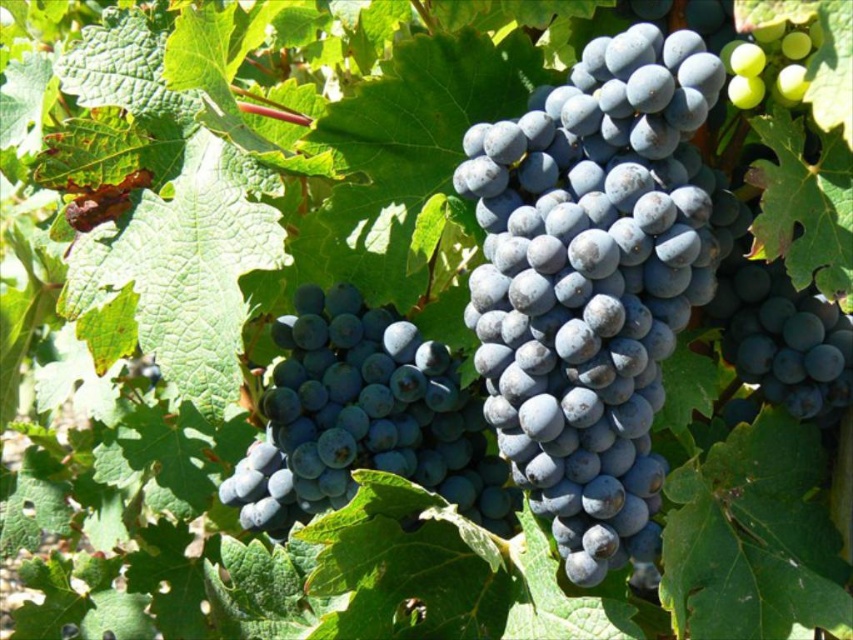
Does point (724, 342) come farther from viewer compared to point (755, 56)?

Yes, point (724, 342) is farther from viewer.

Image resolution: width=853 pixels, height=640 pixels. I want to click on blue matte grape at center, so click(782, 337).

Is shiny dark blue grapes at center wider than green matte grape at upper right?

Indeed, shiny dark blue grapes at center has a greater width compared to green matte grape at upper right.

The image size is (853, 640). I want to click on shiny dark blue grapes at center, so click(361, 419).

Locate an element on the screen. shiny dark blue grapes at center is located at coordinates (361, 419).

Is the position of matte dark blue grapes at center less distant than that of blue matte grape at center?

Yes, matte dark blue grapes at center is closer to the viewer.

Who is lower down, matte dark blue grapes at center or blue matte grape at center?

Positioned lower is blue matte grape at center.

Between point (550, 353) and point (788, 404), which one is positioned behind?

The point (788, 404) is behind.

Where is `matte dark blue grapes at center`? matte dark blue grapes at center is located at coordinates (590, 282).